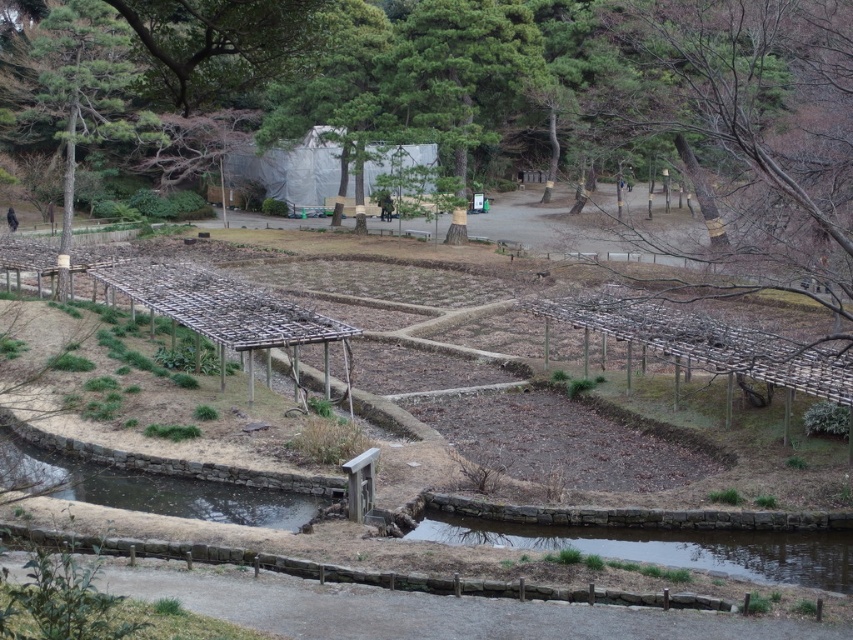
Looking at this image, does clear water at bottom center come behind clear water at bottom left?

No.

Is clear water at bottom center above clear water at bottom left?

Actually, clear water at bottom center is below clear water at bottom left.

Who is more distant from viewer, (x=434, y=536) or (x=283, y=515)?

The point (x=283, y=515) is behind.

The height and width of the screenshot is (640, 853). I want to click on clear water at bottom center, so click(670, 547).

Is point (846, 317) more distant than point (132, 60)?

No.

Does brown wooden trellis at center have a greater width compared to green textured tree at upper left?

No.

Where is `brown wooden trellis at center`? Image resolution: width=853 pixels, height=640 pixels. brown wooden trellis at center is located at coordinates (752, 161).

Image resolution: width=853 pixels, height=640 pixels. In order to click on brown wooden trellis at center in this screenshot , I will do `click(752, 161)`.

Who is more forward, (x=30, y=113) or (x=112, y=506)?

Positioned in front is point (x=112, y=506).

Which of these two, green textured tree at upper left or clear water at bottom left, stands shorter?

clear water at bottom left

Identify the location of green textured tree at upper left. The height and width of the screenshot is (640, 853). (85, 92).

I want to click on green textured tree at upper left, so click(x=85, y=92).